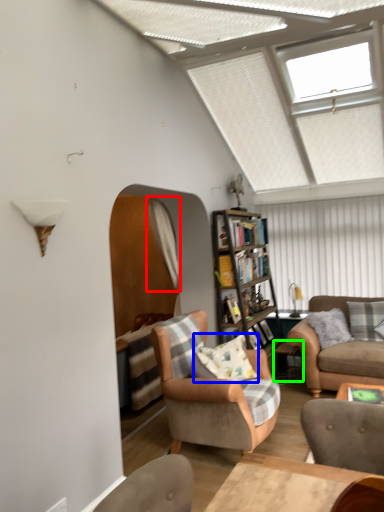
Question: Which is farther away from curtain (highlighted by a red box)? pillow (highlighted by a blue box) or side table (highlighted by a green box)?

Choices:
 (A) pillow
 (B) side table

Answer: (B)